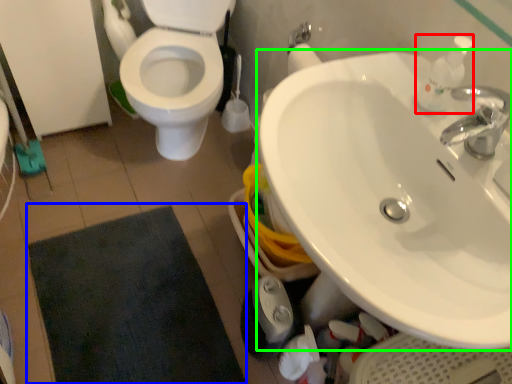
Question: Which is farther away from soap dispenser (highlighted by a red box)? bath mat (highlighted by a blue box) or sink (highlighted by a green box)?

Choices:
 (A) bath mat
 (B) sink

Answer: (A)